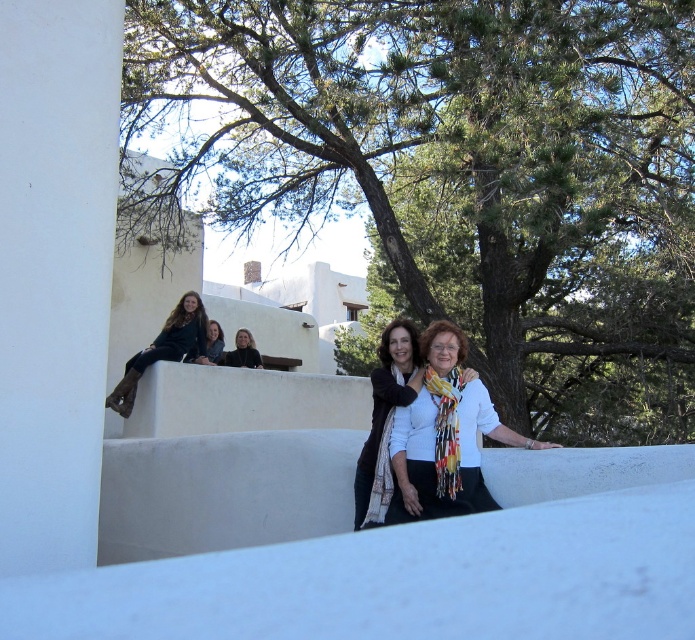
Question: Which object appears closest to the camera in this image?

Choices:
 (A) dark brown leather jacket at upper left
 (B) dark brown leather boots at upper left
 (C) white scarf at center
 (D) matte gray sweater at upper left

Answer: (C)

Question: Does green leafy tree at upper center have a greater width compared to white matte scarf at center?

Choices:
 (A) yes
 (B) no

Answer: (A)

Question: Which point is farther to the camera?

Choices:
 (A) dark brown leather jacket at upper left
 (B) dark brown leather boots at upper left
 (C) white scarf at center

Answer: (A)

Question: Which of these objects is positioned farthest from the white matte scarf at center?

Choices:
 (A) green leafy tree at upper center
 (B) matte gray sweater at upper left
 (C) white scarf at center
 (D) dark brown leather boots at upper left

Answer: (B)

Question: Does green leafy tree at upper center appear under dark brown leather boots at upper left?

Choices:
 (A) yes
 (B) no

Answer: (B)

Question: Does white scarf at center appear on the right side of matte gray sweater at upper left?

Choices:
 (A) yes
 (B) no

Answer: (A)